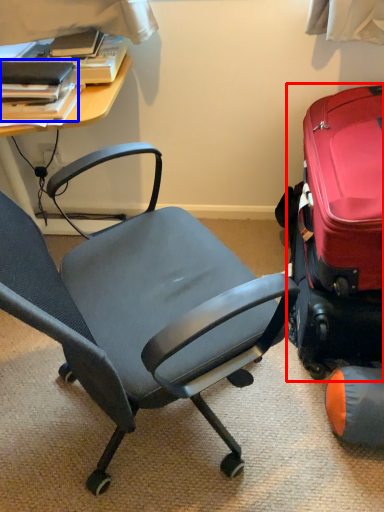
Question: Which point is closer to the camera, suitcase (highlighted by a red box) or book (highlighted by a blue box)?

Choices:
 (A) suitcase
 (B) book

Answer: (A)